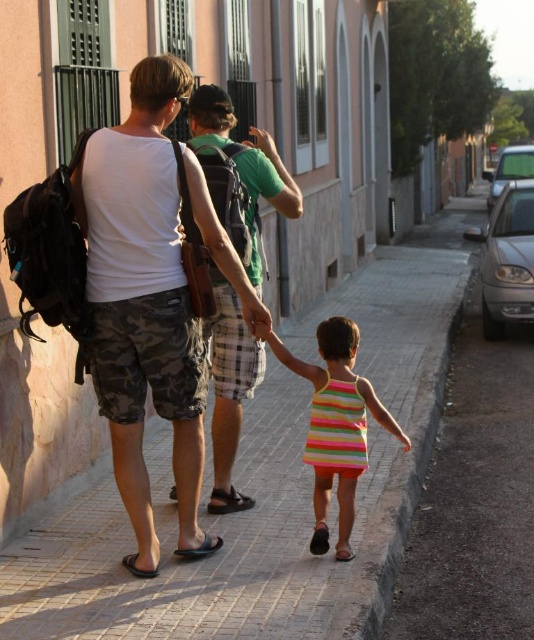
Please describe the location of the paved stone sidewalk at center in the image using coordinates.

The paved stone sidewalk at center is located at coordinates point (271, 486).

You are standing at the point with coordinates point (167, 220) and want to walk towards the point with coordinates point (219, 492). Which direction should you move to reach your destination?

You should move backward because point (167, 220) is in front of point (219, 492), so to reach point (219, 492) you need to move in the opposite direction.

You are standing at the point closer to the camera in this scene. Which point are you at, point [404,269] or point [341,444]?

You are at point [404,269] because it is closer to the camera compared to point [341,444].